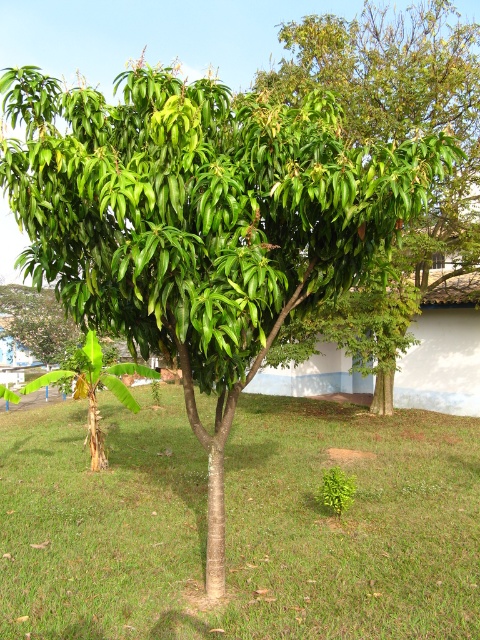
Question: Which object is farther from the camera taking this photo?

Choices:
 (A) green grass at center
 (B) green glossy tree at center

Answer: (B)

Question: Can you confirm if green grass at center is smaller than green glossy tree at center?

Choices:
 (A) no
 (B) yes

Answer: (B)

Question: Among these objects, which one is farthest from the camera?

Choices:
 (A) green glossy tree at center
 (B) green grass at center

Answer: (A)

Question: Is green grass at center to the left of green glossy tree at center from the viewer's perspective?

Choices:
 (A) no
 (B) yes

Answer: (B)

Question: Which point is closer to the camera taking this photo?

Choices:
 (A) (162, 544)
 (B) (463, 188)

Answer: (A)

Question: Does green grass at center have a lesser width compared to green glossy tree at center?

Choices:
 (A) yes
 (B) no

Answer: (B)